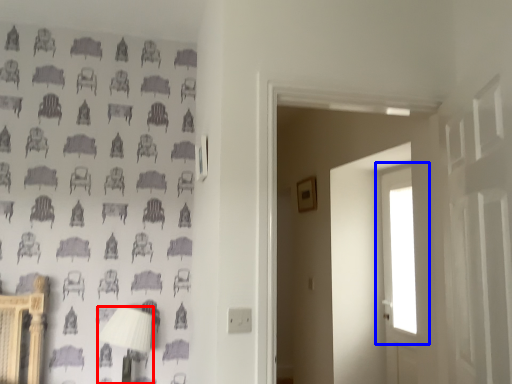
Question: Which object is further to the camera taking this photo, table lamp (highlighted by a red box) or window (highlighted by a blue box)?

Choices:
 (A) table lamp
 (B) window

Answer: (B)